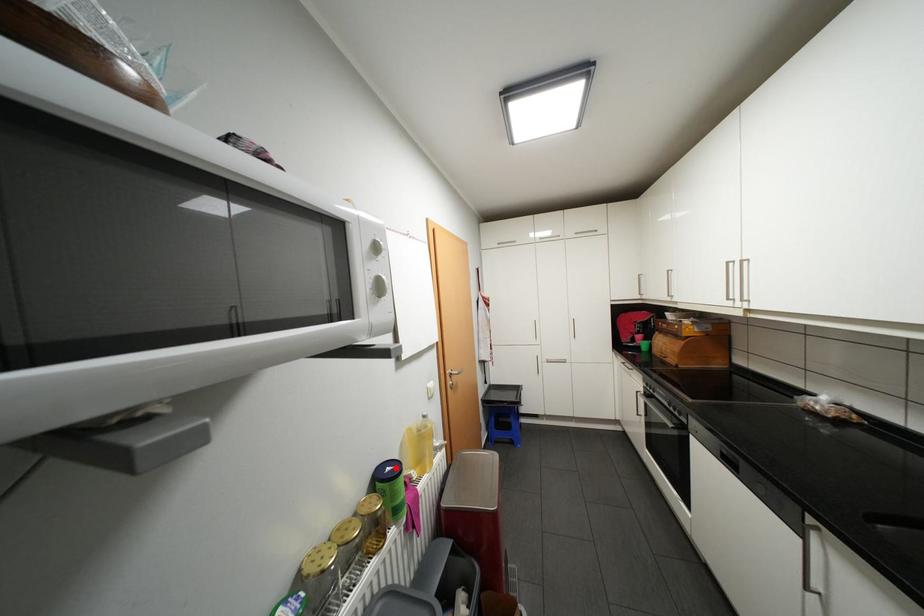
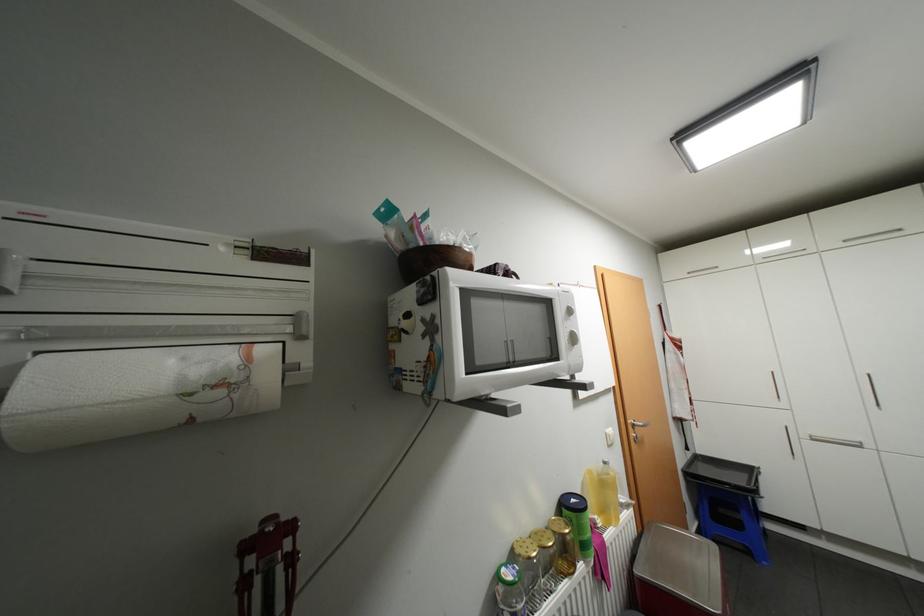
Find the pixel in the second image that matches the highlighted location in the first image.

(580, 499)